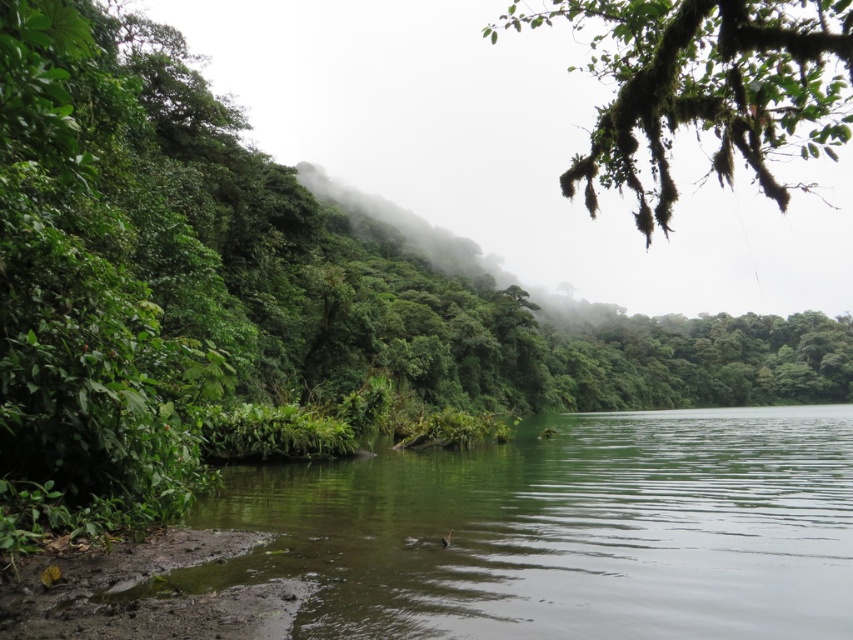
Question: Does green smooth water at lower center appear over green mossy branch at upper right?

Choices:
 (A) no
 (B) yes

Answer: (A)

Question: Does green mossy branch at upper right appear on the left side of green leafy fog at center?

Choices:
 (A) no
 (B) yes

Answer: (A)

Question: Among these points, which one is nearest to the camera?

Choices:
 (A) (616, 429)
 (B) (582, 3)

Answer: (B)

Question: Which object is closer to the camera taking this photo?

Choices:
 (A) green mossy branch at upper right
 (B) green leafy fog at center

Answer: (A)

Question: Which of the following is the closest to the observer?

Choices:
 (A) green smooth water at lower center
 (B) green leafy fog at center
 (C) green mossy branch at upper right

Answer: (A)

Question: Can you confirm if green smooth water at lower center is wider than green leafy fog at center?

Choices:
 (A) no
 (B) yes

Answer: (A)